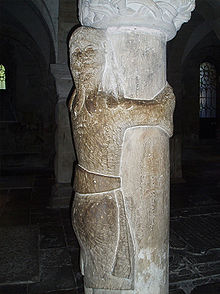
At what (x,y) coordinates should I click in order to perform the action: click on floor left side. Please return your answer as a coordinate pair (x, y). This screenshot has width=220, height=294. Looking at the image, I should click on (42, 271).